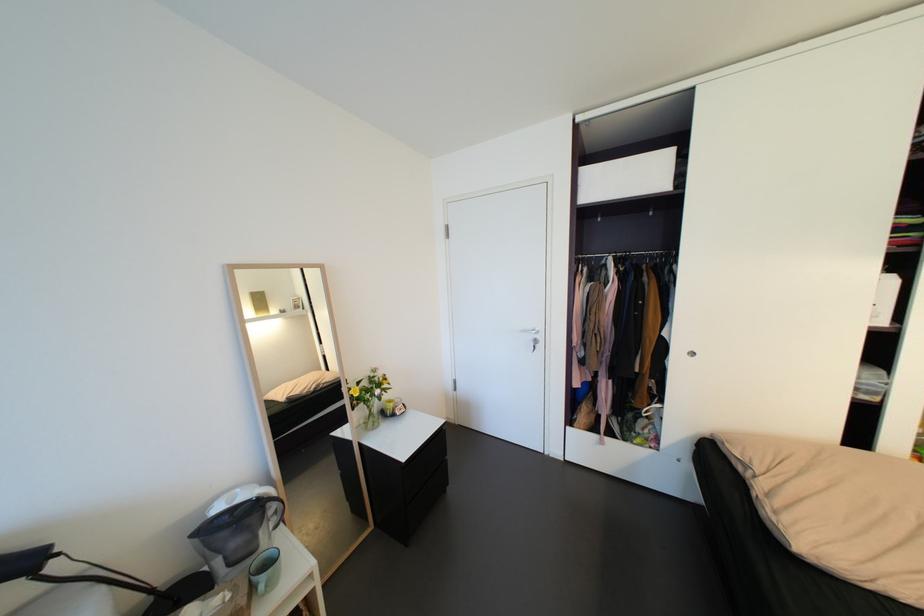
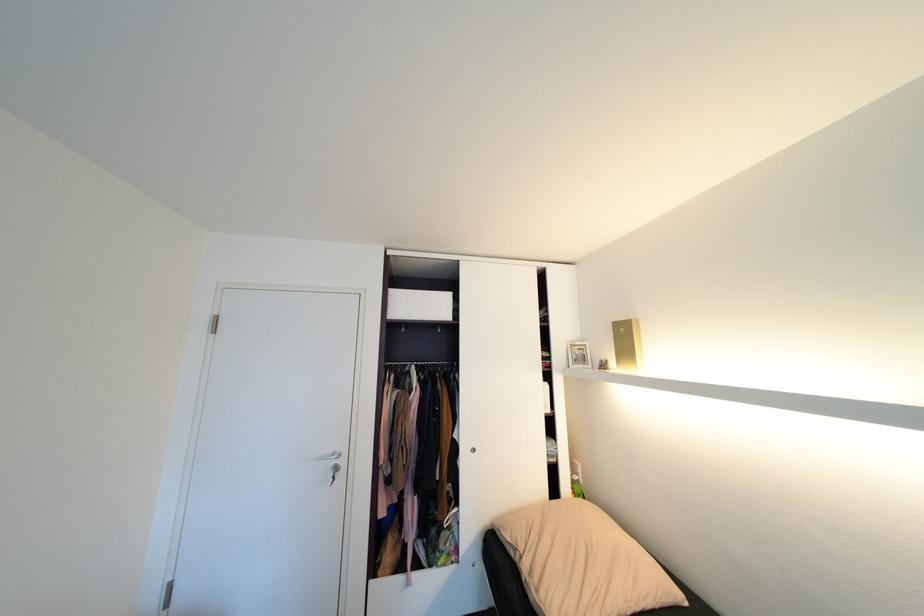
In the second image, find the point that corresponds to [541,339] in the first image.

(341, 467)